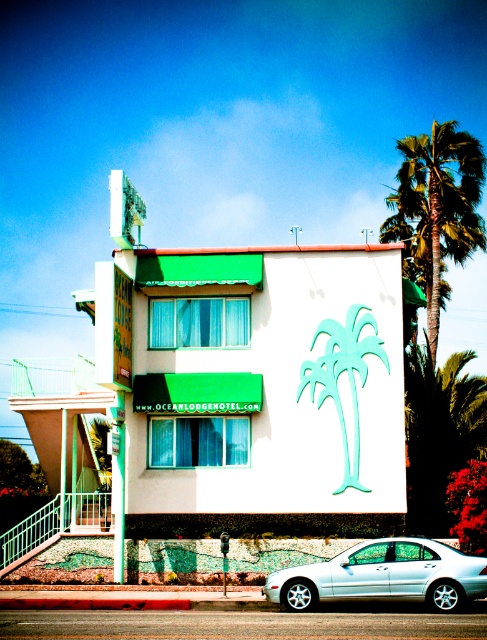
Question: From the image, what is the correct spatial relationship of green leafy palm tree at upper right in relation to white metallic car at lower center?

Choices:
 (A) left
 (B) right

Answer: (B)

Question: Which object appears farthest from the camera in this image?

Choices:
 (A) white metallic car at lower center
 (B) green leafy palm tree at upper right

Answer: (B)

Question: Which point is closer to the camera?

Choices:
 (A) (410, 563)
 (B) (447, 128)

Answer: (A)

Question: Which object is farther from the camera taking this photo?

Choices:
 (A) white metallic car at lower center
 (B) green leafy palm tree at upper right

Answer: (B)

Question: Can you confirm if green leafy palm tree at upper right is positioned above white metallic car at lower center?

Choices:
 (A) yes
 (B) no

Answer: (A)

Question: Can you confirm if green leafy palm tree at upper right is positioned to the left of white metallic car at lower center?

Choices:
 (A) yes
 (B) no

Answer: (B)